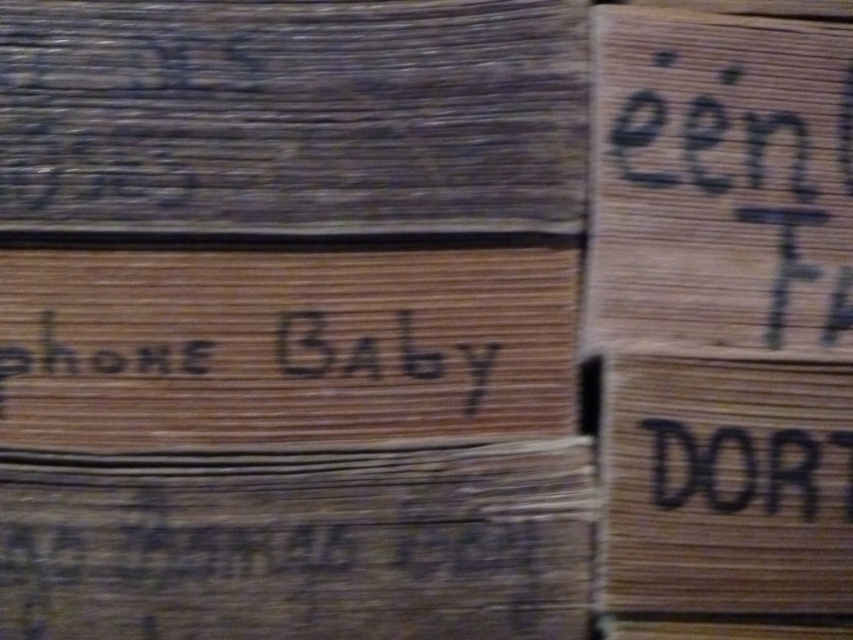
Which is below, wooden signboard at center or black wood phone baby at center?

Positioned lower is wooden signboard at center.

Which is behind, point (161, 557) or point (173, 388)?

Positioned behind is point (173, 388).

Which is behind, point (564, 573) or point (268, 348)?

Point (268, 348)

The image size is (853, 640). I want to click on wooden signboard at center, so click(299, 545).

Is wooden sign at right wider than black wood phone baby at center?

In fact, wooden sign at right might be narrower than black wood phone baby at center.

Which is in front, point (819, 368) or point (474, 381)?

Point (819, 368)

This screenshot has width=853, height=640. Find the location of `wooden sign at right`. wooden sign at right is located at coordinates point(724,484).

Which is more to the right, wooden sign at right or black cardboard at right?

black cardboard at right

Which is more to the left, wooden sign at right or black cardboard at right?

wooden sign at right is more to the left.

Does point (735, 364) come behind point (781, 451)?

Yes, point (735, 364) is behind point (781, 451).

The width and height of the screenshot is (853, 640). I want to click on wooden sign at right, so click(724, 484).